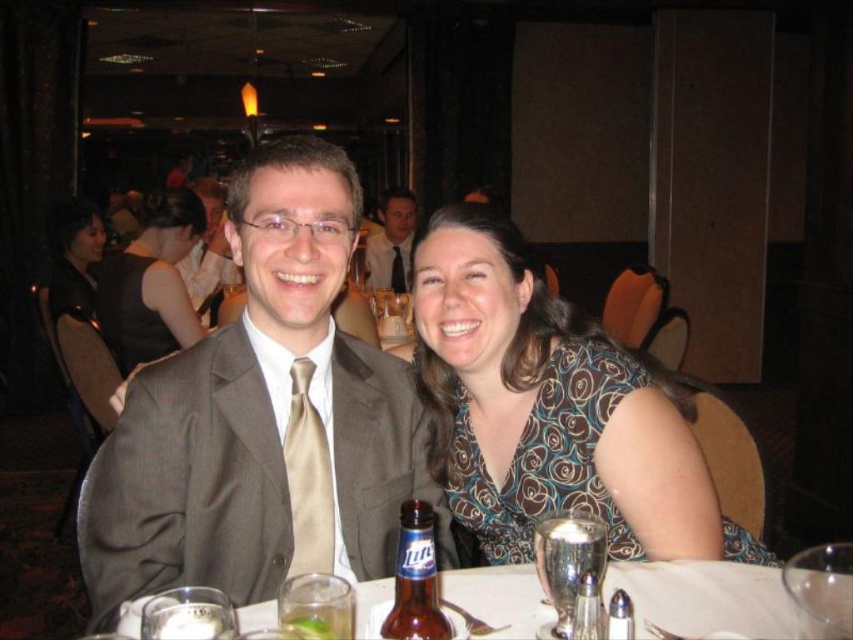
Based on the scene described, which clothing item has a greater width when comparing the patterned fabric blouse at center and the matte black dress at center?

The patterned fabric blouse at center has a greater width than the matte black dress at center according to the description.

You are a photographer at the event and need to position a light to the right of the satin beige tie at center. Will the light also be to the right of the matte black dress at center?

Yes, since the matte black dress at center is to the left of the satin beige tie at center, placing the light to the right of the satin beige tie at center would also place it to the right of the matte black dress at center.